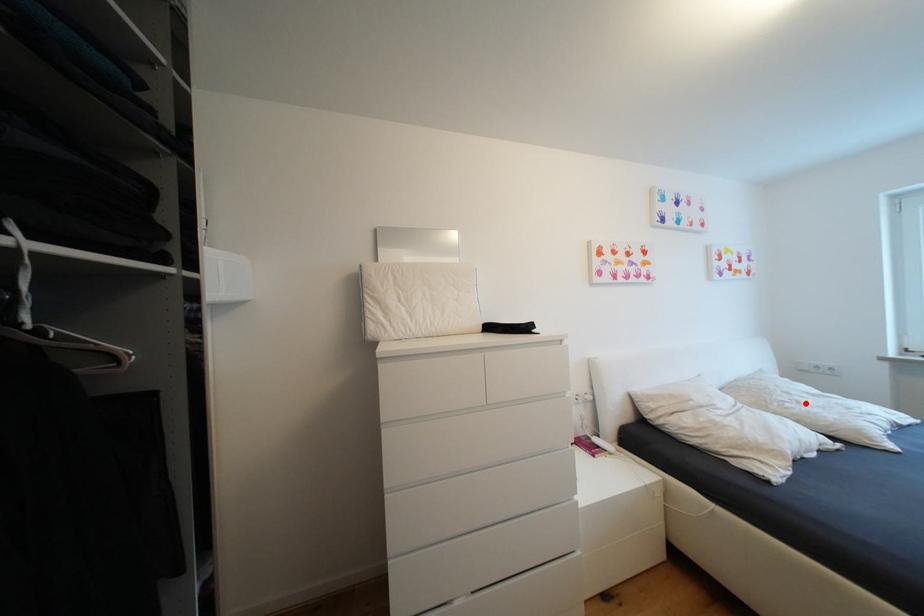
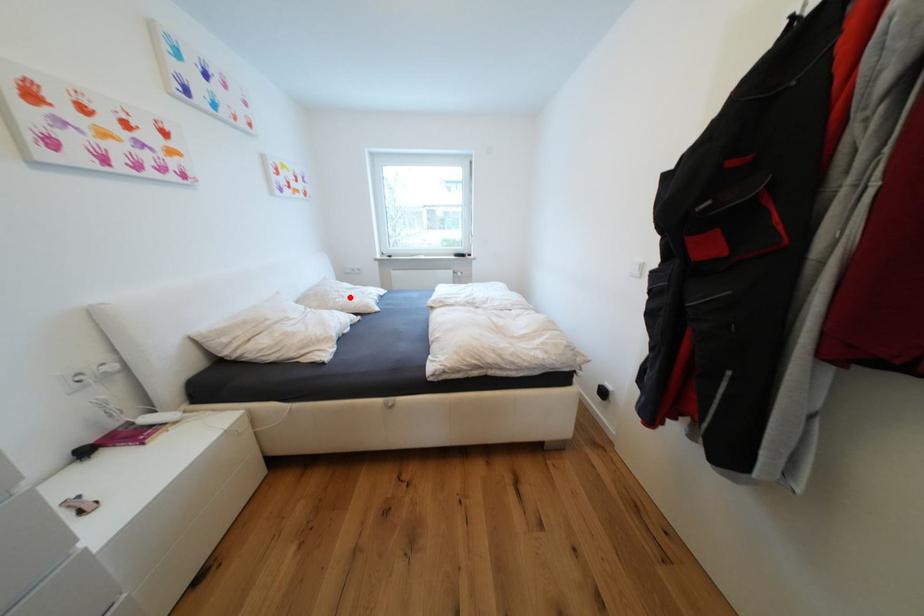
I am providing you with two images of the same scene from different viewpoints. A red point is marked on the first image and another point is marked on the second image. Does the point marked in image1 correspond to the same location as the one in image2?

Yes